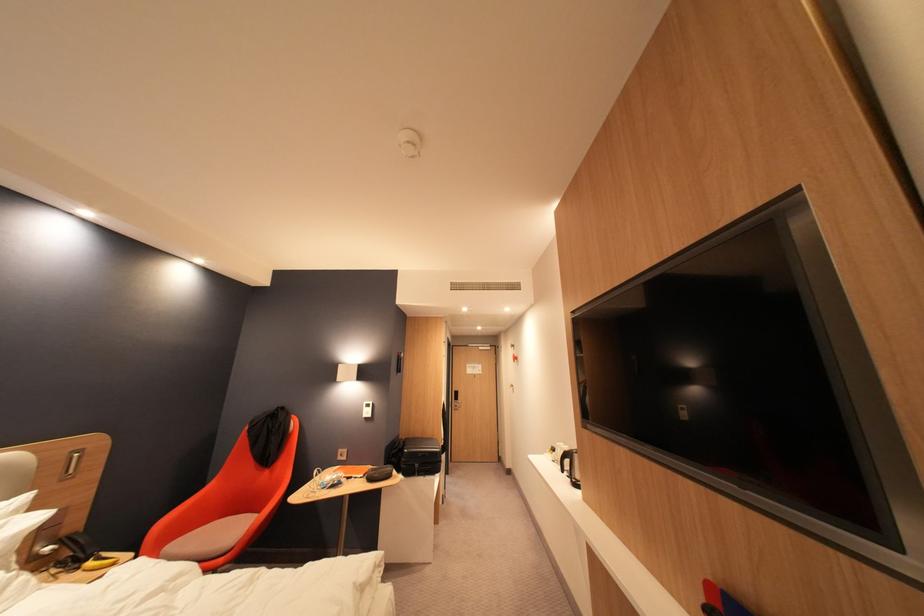
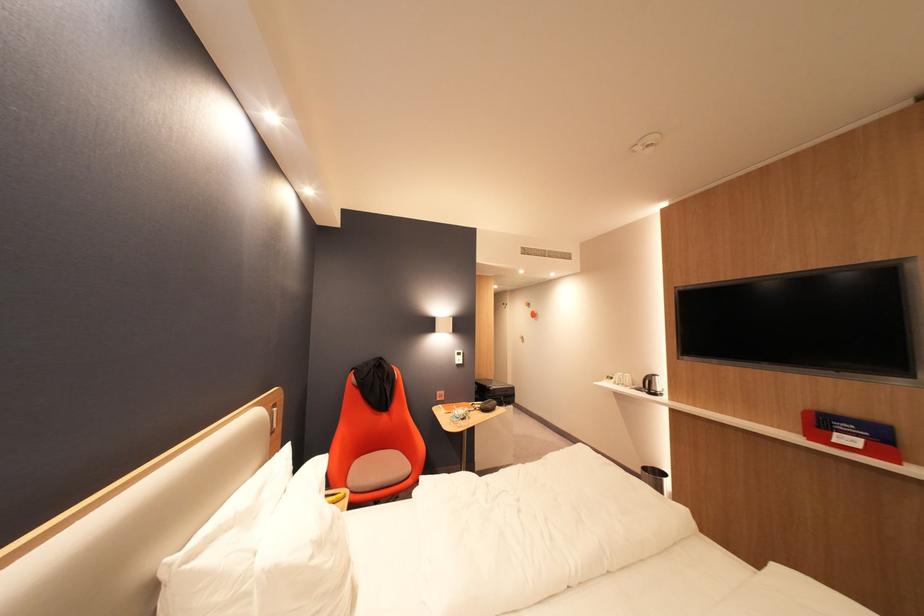
The point at (564,452) is marked in the first image. Where is the corresponding point in the second image?

(622, 379)